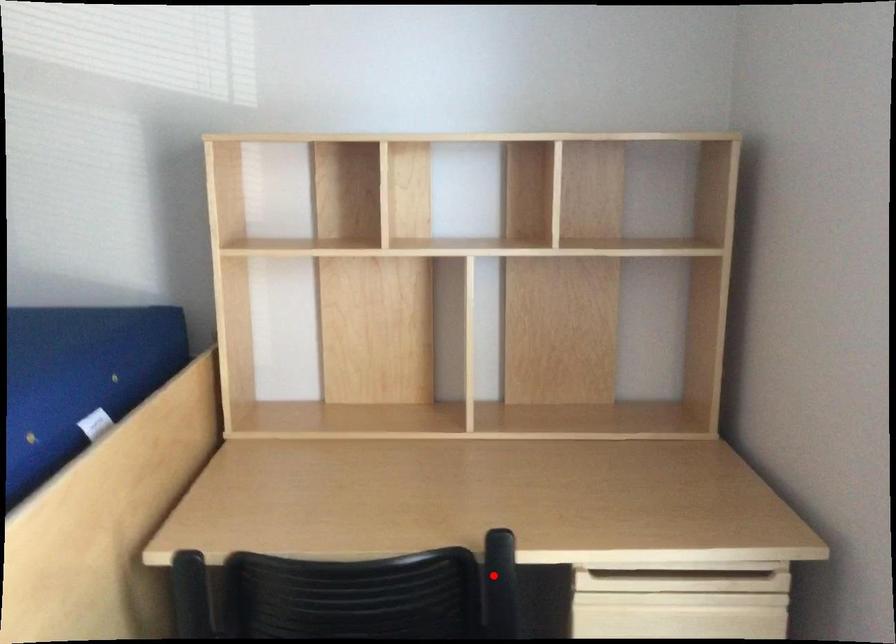
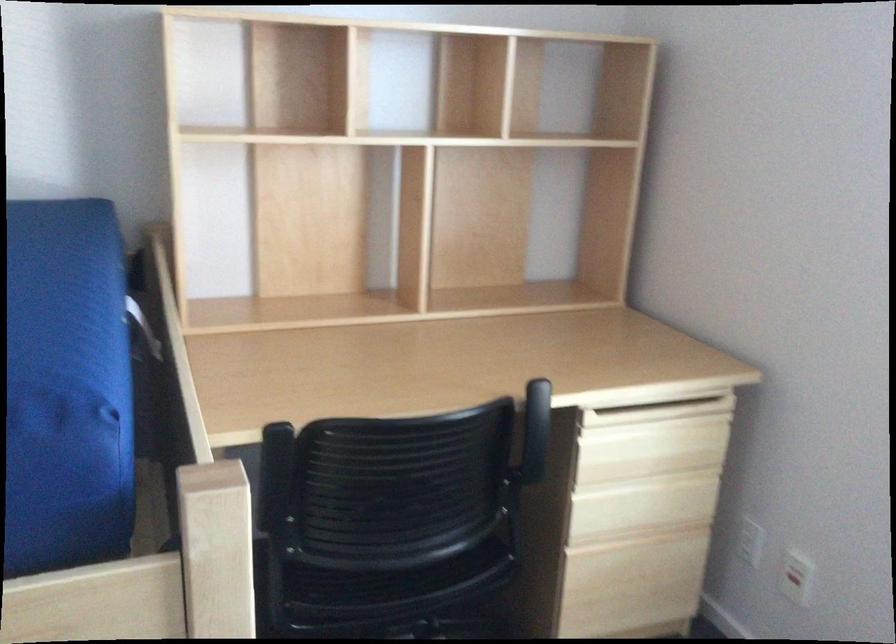
Question: A red point is marked in image1. In image2, is the corresponding 3D point closer to the camera or farther? Reply with the corresponding letter.

Choices:
 (A) The corresponding 3D point is closer.
 (B) The corresponding 3D point is farther.

Answer: (B)